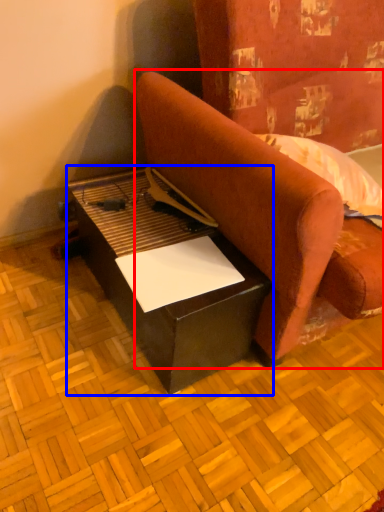
Question: Which object is closer to the camera taking this photo, studio couch (highlighted by a red box) or table (highlighted by a blue box)?

Choices:
 (A) studio couch
 (B) table

Answer: (A)